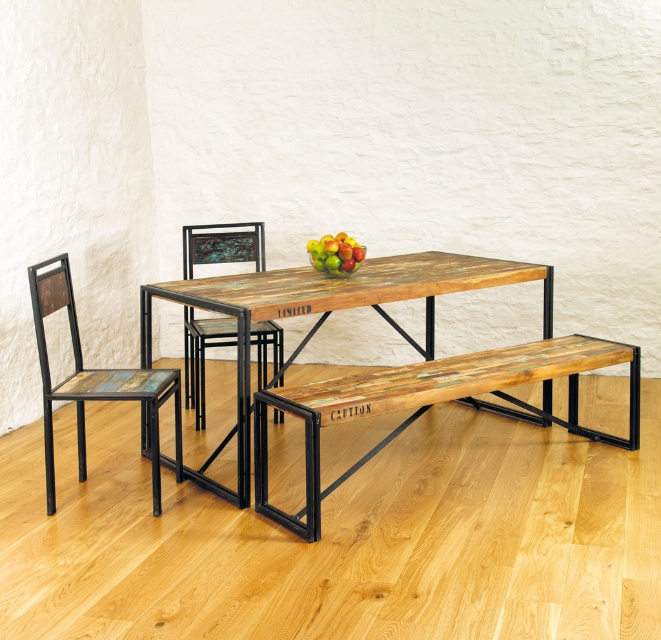
Describe the element at coordinates (95, 380) in the screenshot. I see `distressed wood chair at left` at that location.

Between distressed wood chair at left and rustic wood chair at center, which one appears on the left side from the viewer's perspective?

Positioned to the left is distressed wood chair at left.

Locate an element on the screen. Image resolution: width=661 pixels, height=640 pixels. distressed wood chair at left is located at coordinates (95, 380).

The image size is (661, 640). I want to click on distressed wood chair at left, so click(x=95, y=380).

Does reclaimed wood table at center have a smaller size compared to green matte apples at center?

No, reclaimed wood table at center is not smaller than green matte apples at center.

Does reclaimed wood table at center appear under green matte apples at center?

Yes, reclaimed wood table at center is below green matte apples at center.

I want to click on reclaimed wood table at center, so click(x=325, y=314).

Consider the image. Is reclaimed wood table at center to the right of distressed wood chair at left from the viewer's perspective?

Correct, you'll find reclaimed wood table at center to the right of distressed wood chair at left.

Who is lower down, reclaimed wood table at center or distressed wood chair at left?

Positioned lower is distressed wood chair at left.

Is point (247, 412) farther from camera compared to point (93, 392)?

Yes, point (247, 412) is behind point (93, 392).

Locate an element on the screen. The width and height of the screenshot is (661, 640). reclaimed wood table at center is located at coordinates (325, 314).